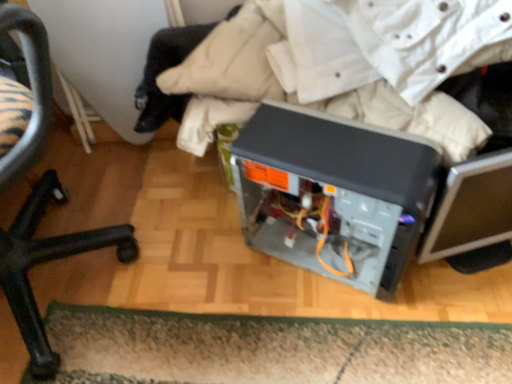
Identify the location of free space in front of satin black computer case at center. (351, 336).